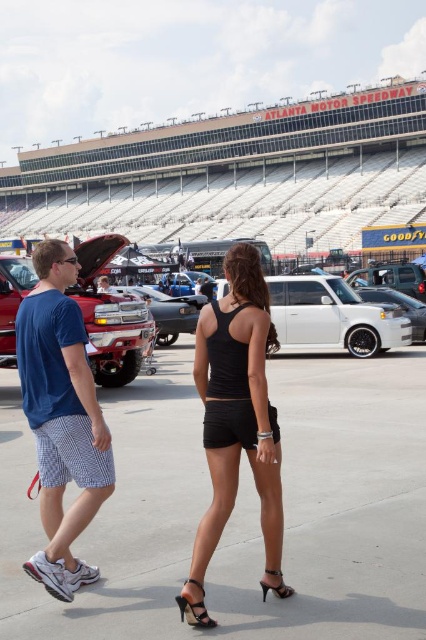
Who is more forward, (256,397) or (203,616)?

Positioned in front is point (203,616).

Does point (196, 365) lie behind point (213, 620)?

That is True.

I want to click on black matte tank top at center, so click(238, 404).

Is point (310, 300) positioned after point (207, 616)?

Yes.

Which is behind, point (330, 314) or point (180, 598)?

Positioned behind is point (330, 314).

I want to click on white matte suv at center, so click(x=333, y=316).

Is white matte suv at center positioned at the back of black patent leather high heels at lower center?

Yes, it is.

What are the coordinates of `white matte suv at center` in the screenshot? It's located at (333, 316).